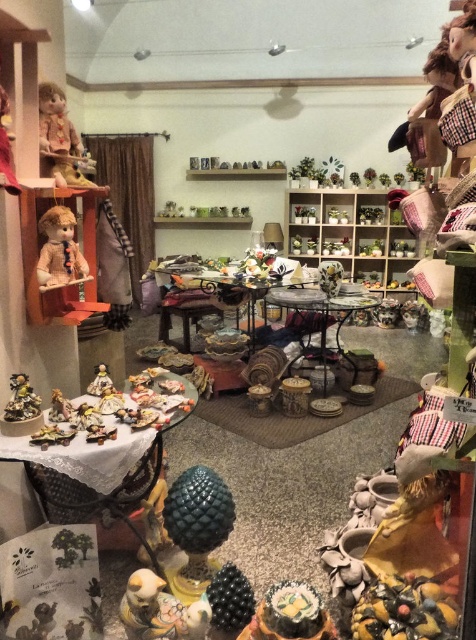
Question: Is wooden doll at left above white lace tablecloth at lower left?

Choices:
 (A) yes
 (B) no

Answer: (A)

Question: Among these objects, which one is nearest to the camera?

Choices:
 (A) matte porcelain figurine at lower left
 (B) matte brown doll at left

Answer: (B)

Question: Among these objects, which one is farthest from the camera?

Choices:
 (A) white lace tablecloth at lower left
 (B) matte brown doll at left

Answer: (B)

Question: Considering the relative positions of white lace tablecloth at lower left and wooden table at center in the image provided, where is white lace tablecloth at lower left located with respect to wooden table at center?

Choices:
 (A) below
 (B) above

Answer: (A)

Question: Is wooden doll at left further to camera compared to matte brown doll at left?

Choices:
 (A) yes
 (B) no

Answer: (B)

Question: Based on their relative distances, which object is farther from the shiny metallic figurines at lower right?

Choices:
 (A) metallic dark brown table at center
 (B) wooden table at center
 (C) white lace tablecloth at lower left

Answer: (B)